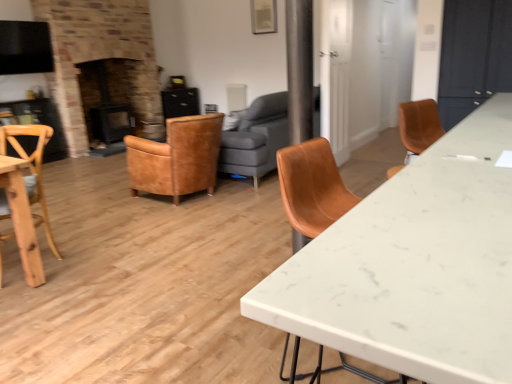
Describe the element at coordinates (32, 168) in the screenshot. I see `natural wood chair at left, which ranks as the first chair in front-to-back order` at that location.

The height and width of the screenshot is (384, 512). Describe the element at coordinates (256, 138) in the screenshot. I see `leather couch at center` at that location.

Image resolution: width=512 pixels, height=384 pixels. I want to click on white marble desk at center, so pyautogui.click(x=414, y=265).

Is leather couch at center oriented away from leather armchair at center, which ranks as the 1th chair in right-to-left order?

leather couch at center does not have its back to leather armchair at center, which ranks as the 1th chair in right-to-left order.

Based on the photo, looking at their sizes, would you say leather couch at center is wider or thinner than leather armchair at center, arranged as the 2th chair when viewed from the front?

Considering their sizes, leather couch at center looks broader than leather armchair at center, arranged as the 2th chair when viewed from the front.

Is leather couch at center taller or shorter than leather armchair at center, arranged as the 2th chair when viewed from the front?

Clearly, leather couch at center is taller compared to leather armchair at center, arranged as the 2th chair when viewed from the front.

Is leather couch at center surrounding leather armchair at center, the 2th chair in the left-to-right sequence?

That's incorrect, leather armchair at center, the 2th chair in the left-to-right sequence, is not inside leather couch at center.

Does natural wood chair at left, the first chair in the left-to-right sequence, have a greater width compared to black matte fireplace at left?

Correct, the width of natural wood chair at left, the first chair in the left-to-right sequence, exceeds that of black matte fireplace at left.

Is point (51, 129) in front of point (90, 103)?

Yes, point (51, 129) is closer to viewer.

Considering the sizes of objects natural wood chair at left, the 2th chair viewed from the right, and black matte fireplace at left in the image provided, who is shorter, natural wood chair at left, the 2th chair viewed from the right, or black matte fireplace at left?

With less height is natural wood chair at left, the 2th chair viewed from the right.

Can you confirm if natural wood chair at left, the second chair in the back-to-front sequence, is positioned to the left of black matte fireplace at left?

No, natural wood chair at left, the second chair in the back-to-front sequence, is not to the left of black matte fireplace at left.

Is there a large distance between natural wood chair at left, the first chair in the left-to-right sequence, and white marble desk at center?

That's right, there is a large distance between natural wood chair at left, the first chair in the left-to-right sequence, and white marble desk at center.

Could you tell me if natural wood chair at left, which ranks as the first chair in front-to-back order, is turned towards white marble desk at center?

No, natural wood chair at left, which ranks as the first chair in front-to-back order, does not turn towards white marble desk at center.

From the image's perspective, would you say natural wood chair at left, the first chair in the left-to-right sequence, is positioned over white marble desk at center?

Yes, from the image's perspective, natural wood chair at left, the first chair in the left-to-right sequence, is above white marble desk at center.

In terms of width, does natural wood chair at left, the 2th chair viewed from the right, look wider or thinner when compared to white marble desk at center?

Considering their sizes, natural wood chair at left, the 2th chair viewed from the right, looks slimmer than white marble desk at center.

From a real-world perspective, is leather armchair at center, arranged as the 2th chair when viewed from the front, on natural wood chair at left, the second chair in the back-to-front sequence?

Actually, leather armchair at center, arranged as the 2th chair when viewed from the front, is physically below natural wood chair at left, the second chair in the back-to-front sequence, in the real world.

In the scene shown: How different are the orientations of leather armchair at center, marked as the 1th chair in a back-to-front arrangement, and natural wood chair at left, the second chair in the back-to-front sequence, in degrees?

104 degrees separate the facing orientations of leather armchair at center, marked as the 1th chair in a back-to-front arrangement, and natural wood chair at left, the second chair in the back-to-front sequence.

This screenshot has width=512, height=384. What are the coordinates of `chair below the leather armchair at center, marked as the 1th chair in a back-to-front arrangement (from the image's perspective)` in the screenshot? It's located at (32, 168).

Can you confirm if leather armchair at center, the 2th chair in the left-to-right sequence, is bigger than natural wood chair at left, which ranks as the first chair in front-to-back order?

Yes.

From the picture: Does black glossy exhaust hood at upper left appear on the left side of black matte fireplace at left?

Yes, black glossy exhaust hood at upper left is to the left of black matte fireplace at left.

In order to click on fireplace below the black glossy exhaust hood at upper left (from a real-world perspective) in this screenshot , I will do `click(108, 101)`.

Considering the points (39, 41) and (97, 125), which point is behind, point (39, 41) or point (97, 125)?

The point (97, 125) is farther from the camera.

Who is shorter, black glossy exhaust hood at upper left or black matte fireplace at left?

Standing shorter between the two is black glossy exhaust hood at upper left.

Is black matte fireplace at left positioned in front of leather couch at center?

No.

Considering the sizes of objects black matte fireplace at left and leather couch at center in the image provided, who is shorter, black matte fireplace at left or leather couch at center?

leather couch at center.

Looking at the image, does black matte fireplace at left seem bigger or smaller compared to leather couch at center?

black matte fireplace at left is smaller than leather couch at center.

This screenshot has width=512, height=384. What are the coordinates of `fireplace behind the leather couch at center` in the screenshot? It's located at (108, 101).

Where is `fireplace above the leather armchair at center, marked as the 1th chair in a back-to-front arrangement (from a real-world perspective)`? fireplace above the leather armchair at center, marked as the 1th chair in a back-to-front arrangement (from a real-world perspective) is located at coordinates (108, 101).

From a real-world perspective, which object stands above the other?

black matte fireplace at left.

Which of these two, leather armchair at center, marked as the 1th chair in a back-to-front arrangement, or black matte fireplace at left, stands taller?

black matte fireplace at left.

Identify the location of studio couch that is above the leather armchair at center, the 2th chair in the left-to-right sequence (from a real-world perspective). (256, 138).

From a real-world perspective, starting from the black matte fireplace at left, which chair is the 1st one below it? Please provide its 2D coordinates.

[(32, 168)]

Based on their spatial positions, is leather armchair at center, arranged as the 2th chair when viewed from the front, or black matte fireplace at left closer to black glossy exhaust hood at upper left?

The object closer to black glossy exhaust hood at upper left is black matte fireplace at left.

Which object lies nearer to the anchor point black matte fireplace at left, black glossy exhaust hood at upper left or natural wood chair at left, the first chair in the left-to-right sequence?

black glossy exhaust hood at upper left lies closer to black matte fireplace at left than the other object.

Considering their positions, is white marble desk at center positioned further to black matte fireplace at left than black glossy exhaust hood at upper left?

white marble desk at center is further to black matte fireplace at left.

From the image, which object appears to be farther from black glossy exhaust hood at upper left, black matte fireplace at left or leather couch at center?

Based on the image, leather couch at center appears to be further to black glossy exhaust hood at upper left.

Considering their positions, is natural wood chair at left, the second chair in the back-to-front sequence, positioned closer to leather couch at center than black matte fireplace at left?

The object closer to leather couch at center is natural wood chair at left, the second chair in the back-to-front sequence.

When comparing their distances from leather couch at center, does white marble desk at center or black glossy exhaust hood at upper left seem closer?

white marble desk at center is positioned closer to the anchor leather couch at center.

Looking at the image, which one is located closer to white marble desk at center, leather armchair at center, the 2th chair in the left-to-right sequence, or leather couch at center?

leather armchair at center, the 2th chair in the left-to-right sequence, is closer to white marble desk at center.

Estimate the real-world distances between objects in this image. Which object is further from black glossy exhaust hood at upper left, leather armchair at center, the 2th chair in the left-to-right sequence, or white marble desk at center?

The object further to black glossy exhaust hood at upper left is white marble desk at center.

Find the location of a particular element. This screenshot has width=512, height=384. exhaust hood between leather armchair at center, arranged as the 2th chair when viewed from the front, and black matte fireplace at left from front to back is located at coordinates (25, 48).

This screenshot has height=384, width=512. What are the coordinates of `chair between natural wood chair at left, which ranks as the first chair in front-to-back order, and black matte fireplace at left, along the z-axis` in the screenshot? It's located at (176, 158).

Find the location of a particular element. chair located between white marble desk at center and leather armchair at center, the 2th chair in the left-to-right sequence, in the depth direction is located at coordinates (32, 168).

Where is `exhaust hood between natural wood chair at left, the 2th chair viewed from the right, and black matte fireplace at left in the front-back direction`? exhaust hood between natural wood chair at left, the 2th chair viewed from the right, and black matte fireplace at left in the front-back direction is located at coordinates (25, 48).